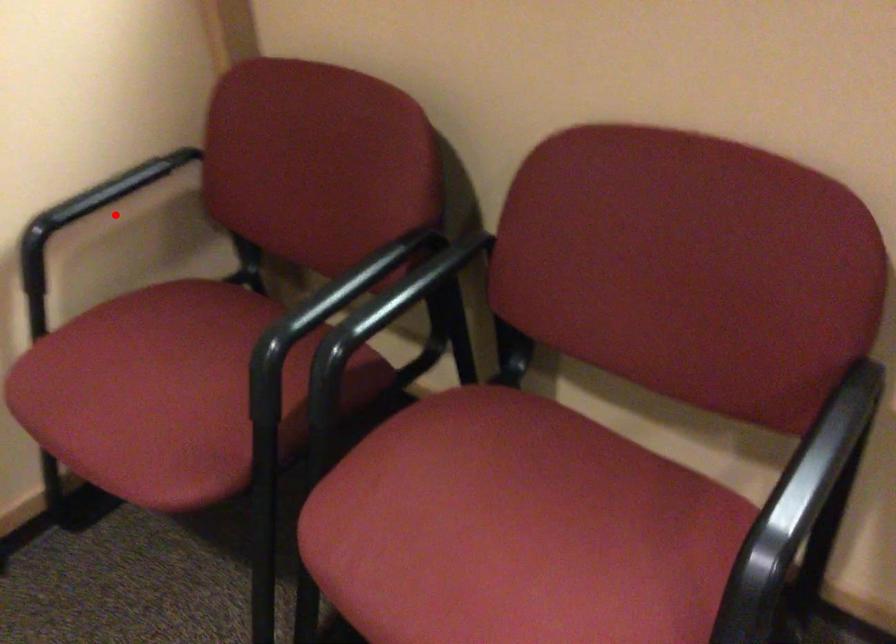
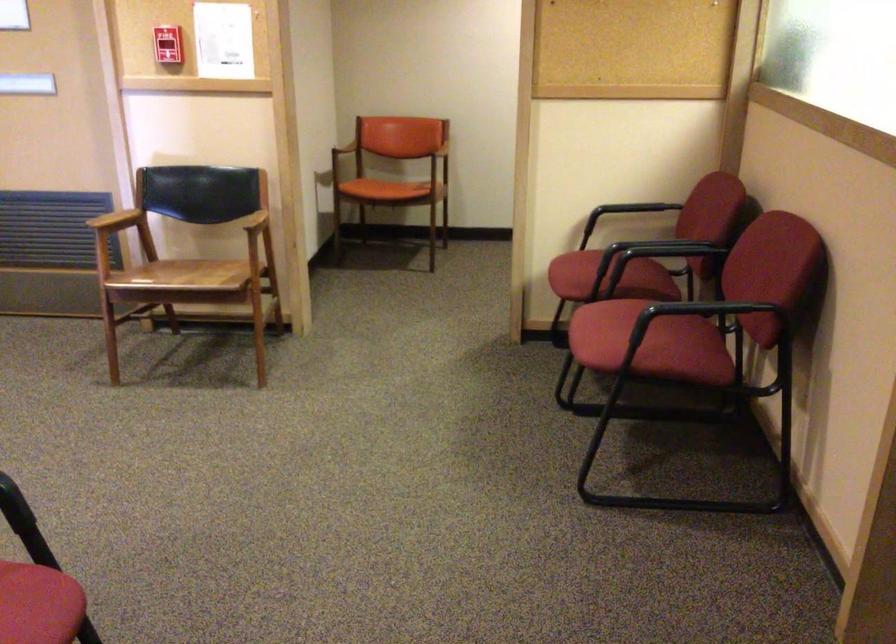
Question: I am providing you with two images of the same scene from different viewpoints. Given a red point in image1, look at the same physical point in image2. Is it:

Choices:
 (A) Closer to the viewpoint
 (B) Farther from the viewpoint

Answer: (B)